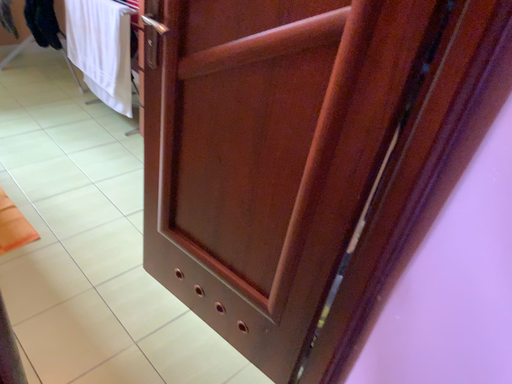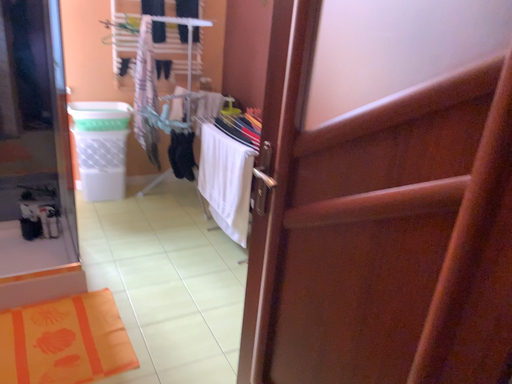
Question: Which way did the camera rotate in the video?

Choices:
 (A) rotated right
 (B) rotated left

Answer: (B)